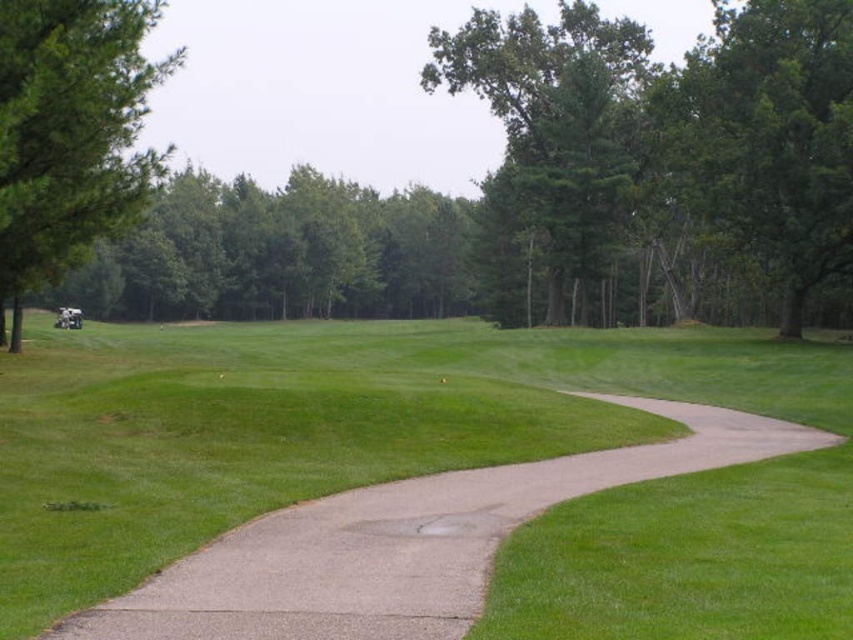
You are a golfer standing on the concrete pathway and want to hit the ball towards the green leafy tree at upper center. Considering the green grass at lower left is narrower than the tree, which direction should you aim to avoid the grass?

The green grass at lower left has a lesser width compared to the green leafy tree at upper center, so you should aim towards the tree to avoid the narrower grass area.

From the picture: You are a golfer standing on the green grass at lower left and want to hit the ball to the green leafy tree at center. Considering the spatial relationship between these two objects, which direction should you aim your shot?

The green grass at lower left is thinner than the green leafy tree at center, so you should aim towards the center where the tree is located to ensure the ball reaches the intended target.

You are a golfer standing on the concrete pathway and want to hit a ball towards the green grass at lower left. Considering the green leafy tree at left, will the tree block your view of the grass?

The green grass at lower left is shorter than the green leafy tree at left, so the tree might block your view depending on the distance and angle. However, since the grass is lower, there might be a line of sight if you position yourself correctly.